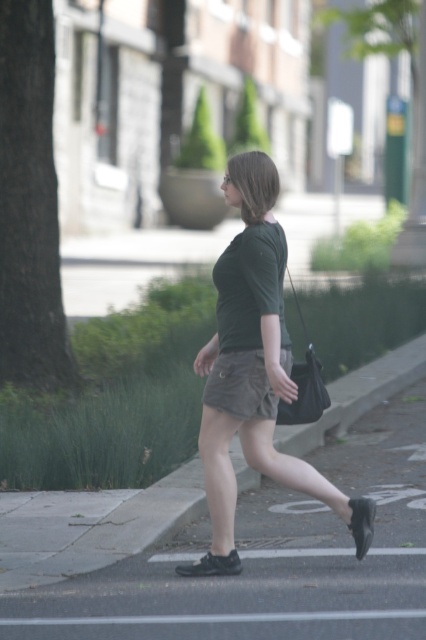
Question: Considering the real-world distances, which object is farthest from the black fabric bag at lower center?

Choices:
 (A) khaki cotton shorts at center
 (B) gray asphalt at lower center

Answer: (B)

Question: Can you confirm if gray asphalt at lower center is wider than black fabric bag at lower center?

Choices:
 (A) no
 (B) yes

Answer: (B)

Question: Which point is closer to the camera taking this photo?

Choices:
 (A) (43, 598)
 (B) (296, 378)

Answer: (A)

Question: Is gray asphalt at lower center to the left of black fabric bag at lower center from the viewer's perspective?

Choices:
 (A) yes
 (B) no

Answer: (B)

Question: Which point is closer to the camera taking this photo?

Choices:
 (A) (317, 417)
 (B) (394, 452)
 (C) (218, 312)
 (D) (238, 380)

Answer: (D)

Question: Can you confirm if green matte skirt at center is positioned to the right of khaki cotton shorts at center?

Choices:
 (A) no
 (B) yes

Answer: (B)